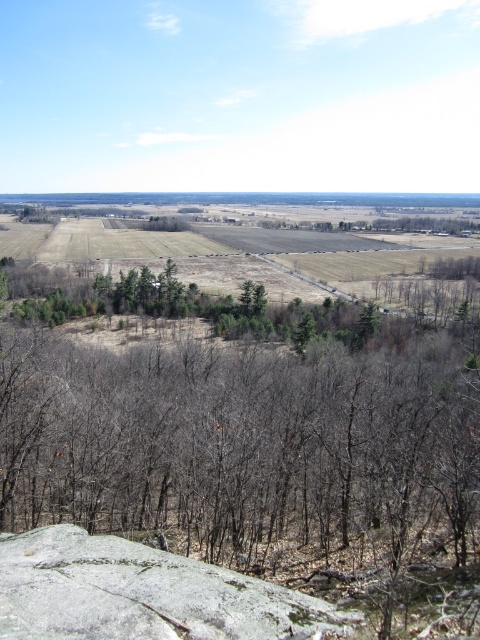
Can you confirm if gray rough rock at center is positioned above blue sky at upper center?

Incorrect, gray rough rock at center is not positioned above blue sky at upper center.

Is gray rough rock at center shorter than blue sky at upper center?

Indeed, gray rough rock at center has a lesser height compared to blue sky at upper center.

Is point (201, 634) farther from camera compared to point (235, 198)?

No, it is not.

The height and width of the screenshot is (640, 480). I want to click on gray rough rock at center, so click(142, 593).

From the picture: Can you confirm if green matte trees at center is shorter than blue sky at upper center?

Incorrect, green matte trees at center's height does not fall short of blue sky at upper center's.

Is green matte trees at center positioned in front of blue sky at upper center?

Yes, green matte trees at center is in front of blue sky at upper center.

Is point (180, 397) positioned in front of point (97, 193)?

Yes, point (180, 397) is in front of point (97, 193).

I want to click on green matte trees at center, so click(264, 460).

Is green matte trees at center wider than gray rough rock at center?

Yes.

Is point (375, 401) farther from viewer compared to point (177, 556)?

That is True.

What are the coordinates of `green matte trees at center` in the screenshot? It's located at (264, 460).

Find the location of `green matte trees at center`. green matte trees at center is located at coordinates (264, 460).